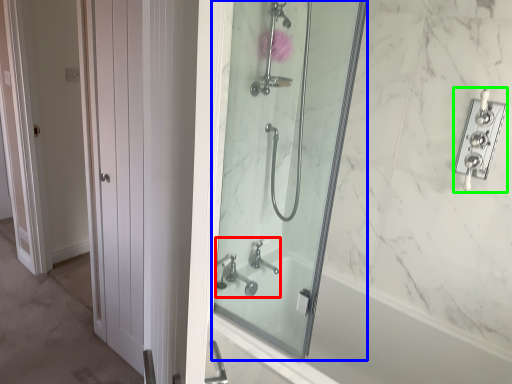
Question: Which object is the closest to the sink (highlighted by a red box)? Choose among these: mirror (highlighted by a blue box) or lock (highlighted by a green box).

Choices:
 (A) mirror
 (B) lock

Answer: (A)